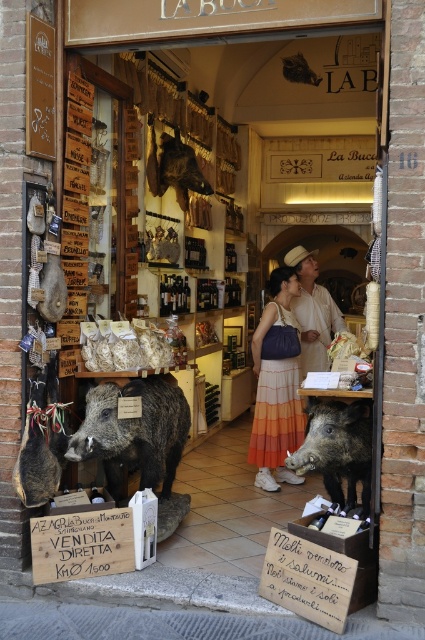
Question: Among these points, which one is nearest to the camera?

Choices:
 (A) (291, 461)
 (B) (252, 349)
 (C) (180, 401)
 (D) (320, 353)

Answer: (A)

Question: Which point appears closest to the camera in this image?

Choices:
 (A) (305, 337)
 (B) (316, 404)
 (C) (153, 465)
 (D) (289, 67)

Answer: (B)

Question: Can you confirm if brown textured wild boar at center is thinner than striped cotton dress at center?

Choices:
 (A) yes
 (B) no

Answer: (B)

Question: Which point is closer to the camera?

Choices:
 (A) (297, 324)
 (B) (302, 260)
 (C) (365, 486)
 (D) (96, 401)

Answer: (D)

Question: From the image, what is the correct spatial relationship of striped cotton dress at center in relation to shiny brown leather bag at upper center?

Choices:
 (A) left
 (B) right

Answer: (A)

Question: Is dark brown fur wild boar at center to the right of light beige straw hat at center from the viewer's perspective?

Choices:
 (A) no
 (B) yes

Answer: (A)